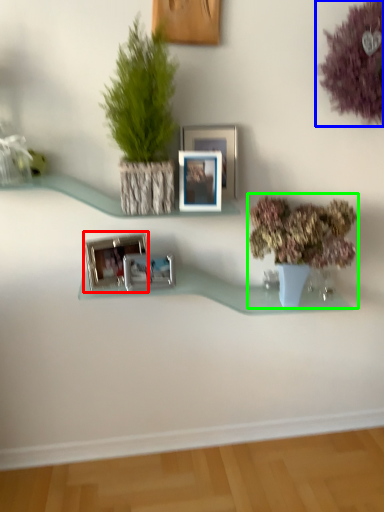
Question: Which object is positioned closest to picture frame (highlighted by a red box)? Select from flower (highlighted by a blue box) and houseplant (highlighted by a green box).

Choices:
 (A) flower
 (B) houseplant

Answer: (B)